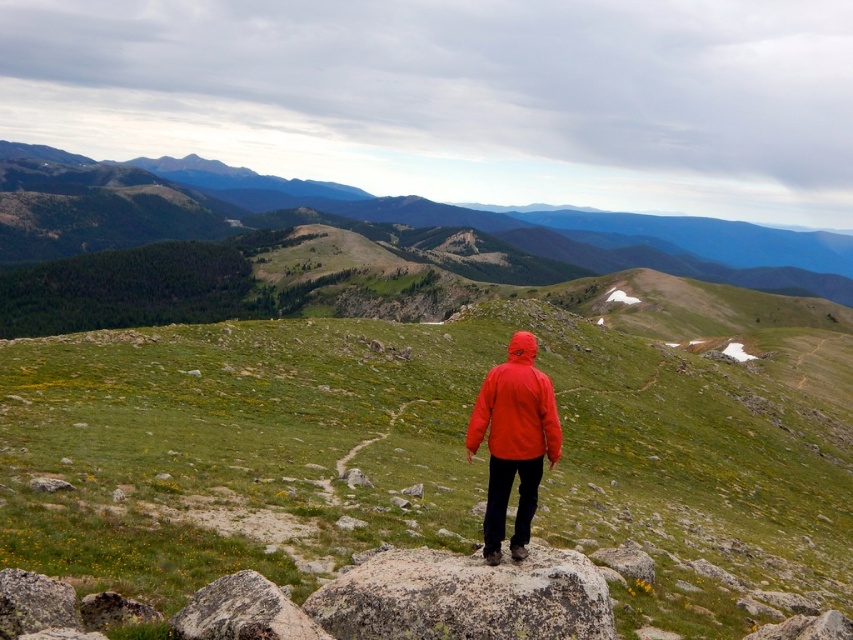
Question: Which point is closer to the camera taking this photo?

Choices:
 (A) (641, 317)
 (B) (496, 545)

Answer: (B)

Question: Among these objects, which one is farthest from the camera?

Choices:
 (A) green grassy hill at upper center
 (B) green grassy hillside at center
 (C) matte orange jacket at center

Answer: (A)

Question: Which object appears farthest from the camera in this image?

Choices:
 (A) green grassy hill at upper center
 (B) matte orange jacket at center

Answer: (A)

Question: Does green grassy hill at upper center have a larger size compared to matte orange jacket at center?

Choices:
 (A) yes
 (B) no

Answer: (A)

Question: Is green grassy hill at upper center positioned behind matte orange jacket at center?

Choices:
 (A) no
 (B) yes

Answer: (B)

Question: Can you confirm if green grassy hillside at center is bigger than matte orange jacket at center?

Choices:
 (A) yes
 (B) no

Answer: (A)